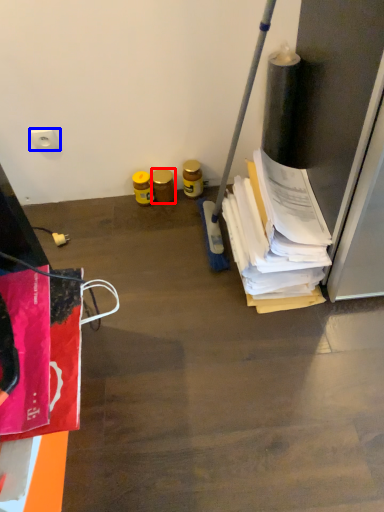
Question: Which object appears closest to the camera in this image, bottle (highlighted by a red box) or power plugs and sockets (highlighted by a blue box)?

Choices:
 (A) bottle
 (B) power plugs and sockets

Answer: (B)